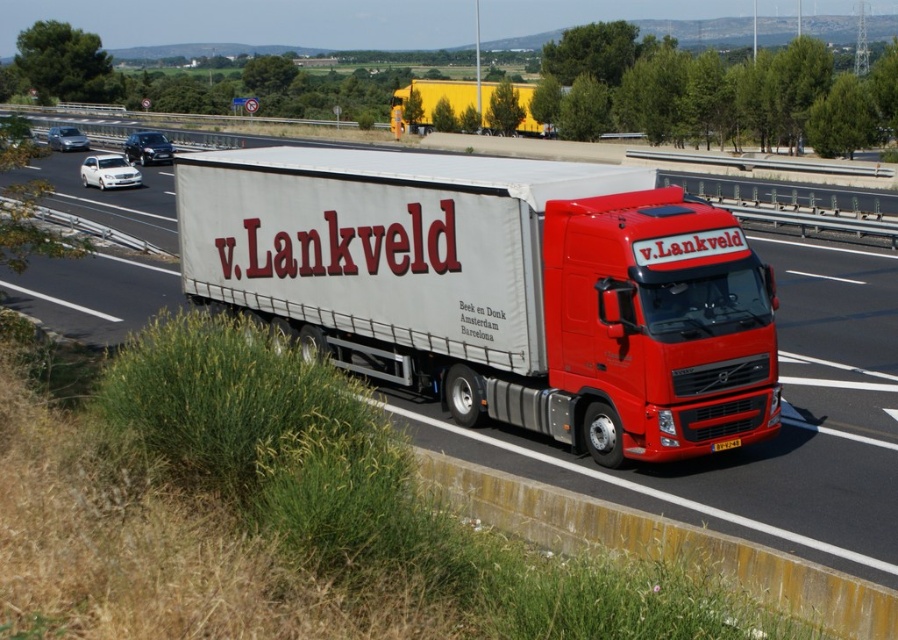
Can you confirm if white matte trailer truck at center is positioned to the left of yellow matte trailer at upper center?

Indeed, white matte trailer truck at center is positioned on the left side of yellow matte trailer at upper center.

Which of these two, white matte trailer truck at center or yellow matte trailer at upper center, stands shorter?

Standing shorter between the two is white matte trailer truck at center.

Find the location of `white matte trailer truck at center`. white matte trailer truck at center is located at coordinates (498, 289).